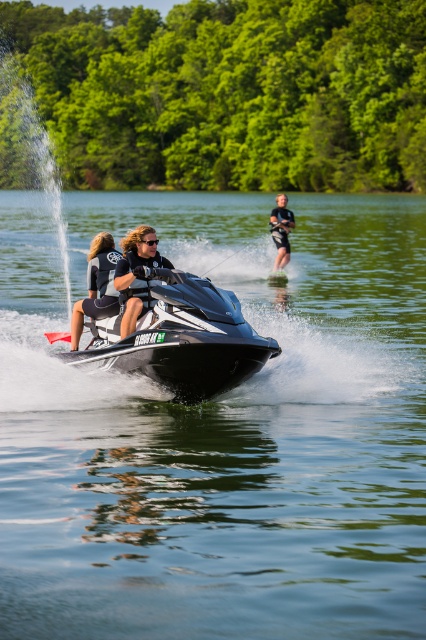
Question: Considering the real-world distances, which object is farthest from the shiny black jet ski at center?

Choices:
 (A) matte black life vest at center
 (B) matte black jet ski at center
 (C) black wetsuit at upper right
 (D) glossy black jet ski at center

Answer: (C)

Question: Considering the real-world distances, which object is farthest from the black wetsuit at upper right?

Choices:
 (A) shiny black jet ski at center
 (B) glossy black jet ski at center
 (C) matte black life vest at center

Answer: (A)

Question: Which point is farther to the camera?

Choices:
 (A) glossy black jet ski at center
 (B) shiny black jet ski at center
 (C) black wetsuit at upper right
 (D) matte black jet ski at center

Answer: (C)

Question: Is glossy black jet ski at center closer to the viewer compared to black wetsuit at upper right?

Choices:
 (A) yes
 (B) no

Answer: (A)

Question: Can you confirm if glossy black jet ski at center is positioned to the left of matte black jet ski at center?

Choices:
 (A) yes
 (B) no

Answer: (B)

Question: Does shiny black jet ski at center appear under matte black jet ski at center?

Choices:
 (A) yes
 (B) no

Answer: (A)